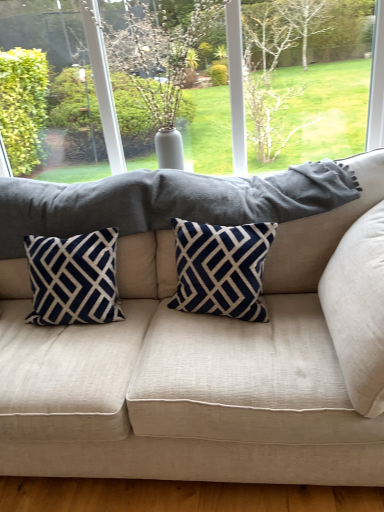
Question: Is beige fabric couch at center turned away from green leafy tree at upper center?

Choices:
 (A) yes
 (B) no

Answer: (B)

Question: Could green leafy tree at upper center be considered to be inside beige fabric couch at center?

Choices:
 (A) yes
 (B) no

Answer: (B)

Question: From a real-world perspective, is beige fabric couch at center under green leafy tree at upper center?

Choices:
 (A) no
 (B) yes

Answer: (B)

Question: Does beige fabric couch at center touch green leafy tree at upper center?

Choices:
 (A) no
 (B) yes

Answer: (A)

Question: From a real-world perspective, is beige fabric couch at center on green leafy tree at upper center?

Choices:
 (A) no
 (B) yes

Answer: (A)

Question: Is navy velvet pillow at left, arranged as the 1th pillow when viewed from the left, in front of or behind green leafy tree at upper center in the image?

Choices:
 (A) front
 (B) behind

Answer: (A)

Question: Would you say navy velvet pillow at left, which ranks as the 3th pillow in right-to-left order, is inside or outside green leafy tree at upper center?

Choices:
 (A) inside
 (B) outside

Answer: (B)

Question: From the image's perspective, relative to green leafy tree at upper center, is navy velvet pillow at left, which ranks as the 3th pillow in right-to-left order, above or below?

Choices:
 (A) above
 (B) below

Answer: (B)

Question: Is navy velvet pillow at left, which ranks as the 3th pillow in right-to-left order, to the left or to the right of green leafy tree at upper center in the image?

Choices:
 (A) left
 (B) right

Answer: (A)

Question: In terms of size, does navy velvet pillow at left, which ranks as the 3th pillow in right-to-left order, appear bigger or smaller than navy blue velvet pillow at center, the 2th pillow in the right-to-left sequence?

Choices:
 (A) small
 (B) big

Answer: (B)

Question: From the image's perspective, is navy velvet pillow at left, which ranks as the 3th pillow in right-to-left order, positioned above or below navy blue velvet pillow at center, placed as the second pillow when sorted from left to right?

Choices:
 (A) above
 (B) below

Answer: (B)

Question: Visually, is navy velvet pillow at left, arranged as the 1th pillow when viewed from the left, positioned to the left or to the right of navy blue velvet pillow at center, the 2th pillow in the right-to-left sequence?

Choices:
 (A) right
 (B) left

Answer: (B)

Question: Does point (110, 261) appear closer or farther from the camera than point (246, 302)?

Choices:
 (A) closer
 (B) farther

Answer: (B)

Question: From a real-world perspective, relative to navy velvet pillow at left, which ranks as the 3th pillow in right-to-left order, is beige fabric couch at center vertically above or below?

Choices:
 (A) below
 (B) above

Answer: (A)

Question: Is beige fabric couch at center inside the boundaries of navy velvet pillow at left, which ranks as the 3th pillow in right-to-left order, or outside?

Choices:
 (A) outside
 (B) inside

Answer: (A)